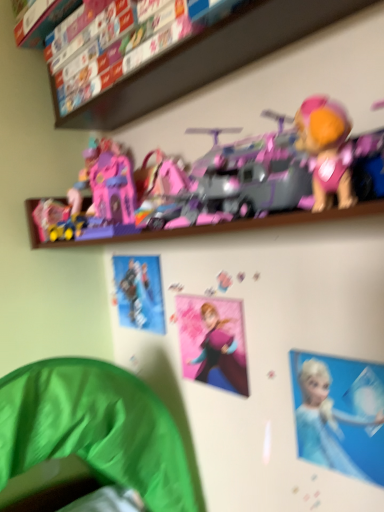
Question: From the image's perspective, is pink plastic castle at upper center, acting as the second toy starting from the bottom, on top of pink matte anna poster at center, the first toy in the bottom-to-top sequence?

Choices:
 (A) yes
 (B) no

Answer: (A)

Question: Is pink plastic castle at upper center, acting as the second toy starting from the bottom, looking in the opposite direction of pink matte anna poster at center, which is counted as the second toy, starting from the top?

Choices:
 (A) yes
 (B) no

Answer: (B)

Question: Is pink plastic castle at upper center, placed as the 1th toy when sorted from top to bottom, smaller than pink matte anna poster at center, which is counted as the second toy, starting from the top?

Choices:
 (A) yes
 (B) no

Answer: (B)

Question: Can you confirm if pink plastic castle at upper center, acting as the second toy starting from the bottom, is wider than pink matte anna poster at center, the first toy in the bottom-to-top sequence?

Choices:
 (A) no
 (B) yes

Answer: (B)

Question: Does pink plastic castle at upper center, placed as the 1th toy when sorted from top to bottom, appear on the right side of pink matte anna poster at center, which is counted as the second toy, starting from the top?

Choices:
 (A) no
 (B) yes

Answer: (A)

Question: From the image's perspective, relative to pink matte anna poster at center, the first toy in the bottom-to-top sequence, is pink plastic castle at upper center, placed as the 1th toy when sorted from top to bottom, above or below?

Choices:
 (A) above
 (B) below

Answer: (A)

Question: In terms of size, does pink plastic castle at upper center, acting as the second toy starting from the bottom, appear bigger or smaller than pink matte anna poster at center, the first toy in the bottom-to-top sequence?

Choices:
 (A) big
 (B) small

Answer: (A)

Question: Is pink plastic castle at upper center, placed as the 1th toy when sorted from top to bottom, wider or thinner than pink matte anna poster at center, the first toy in the bottom-to-top sequence?

Choices:
 (A) wide
 (B) thin

Answer: (A)

Question: Is pink plastic castle at upper center, placed as the 1th toy when sorted from top to bottom, to the left or to the right of pink matte anna poster at center, the first toy in the bottom-to-top sequence, in the image?

Choices:
 (A) right
 (B) left

Answer: (B)

Question: From the image's perspective, is metallic silver figure at upper center, marked as the 2th person in a front-to-back arrangement, located above or below blue glossy poster at upper center, which ranks as the first person in bottom-to-top order?

Choices:
 (A) below
 (B) above

Answer: (B)

Question: In terms of width, does metallic silver figure at upper center, the first person positioned from the left, look wider or thinner when compared to blue glossy poster at upper center, which ranks as the first person in bottom-to-top order?

Choices:
 (A) wide
 (B) thin

Answer: (A)

Question: From a real-world perspective, is metallic silver figure at upper center, marked as the 2th person in a front-to-back arrangement, positioned above or below blue glossy poster at upper center, the 2th person when ordered from left to right?

Choices:
 (A) below
 (B) above

Answer: (B)

Question: In terms of height, does metallic silver figure at upper center, marked as the 2th person in a front-to-back arrangement, look taller or shorter compared to blue glossy poster at upper center, which ranks as the first person in bottom-to-top order?

Choices:
 (A) tall
 (B) short

Answer: (A)

Question: Is point (339, 12) positioned closer to the camera than point (205, 376)?

Choices:
 (A) farther
 (B) closer

Answer: (B)

Question: From a real-world perspective, is pink plastic toys at upper center positioned above or below pink matte anna poster at center, which is counted as the second toy, starting from the top?

Choices:
 (A) below
 (B) above

Answer: (B)